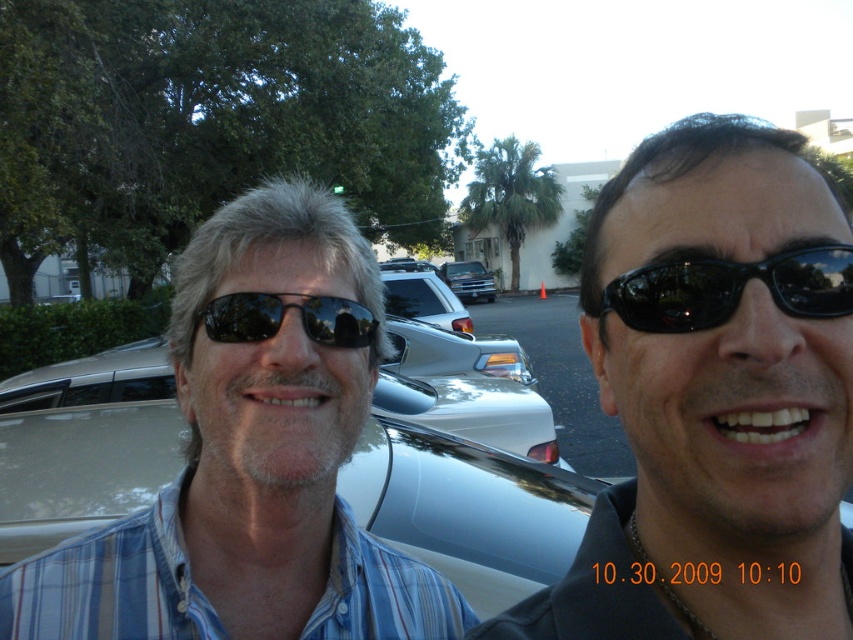
You are a photographer trying to capture a clear shot of both the black glossy sunglasses at center and the metallic silver truck at center. Based on their positions, which object should you focus on first to ensure both are in frame?

The black glossy sunglasses at center is much taller than the metallic silver truck at center, so you should focus on the black glossy sunglasses at center first to ensure both are in frame.

You are trying to locate the black reflective sunglasses at center in the image. According to the scene description, where would you find them?

The black reflective sunglasses at center are located at point (282, 317).

You are trying to locate the black glossy sunglasses at center in the image. According to the scene description, where exactly would you find them?

The black glossy sunglasses at center are located at point coordinates of [714,397].